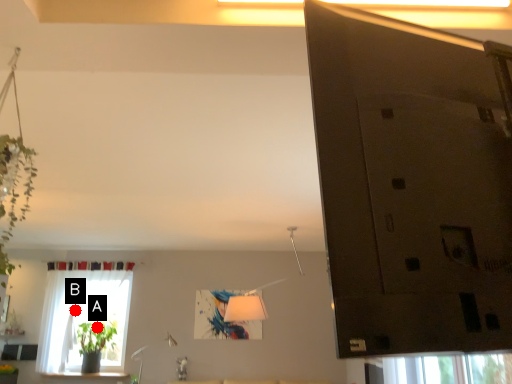
Question: Two points are circled on the image, labeled by A and B beside each circle. Which point appears farthest from the camera in this image?

Choices:
 (A) A is further
 (B) B is further

Answer: (B)